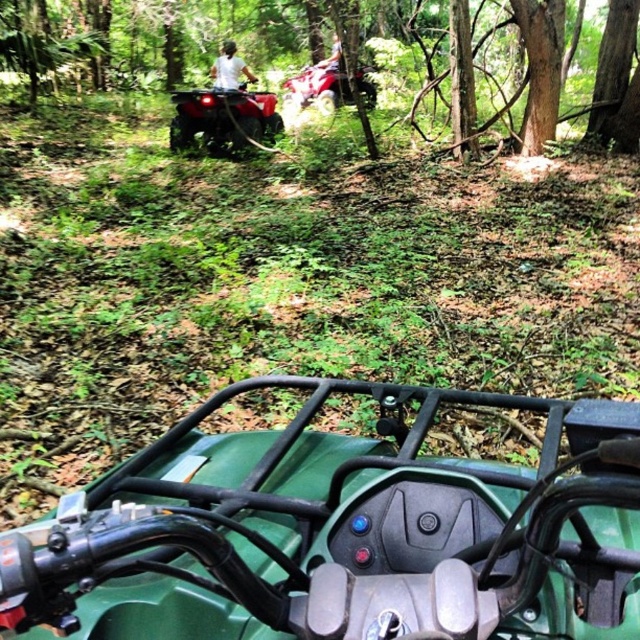
You are riding the green matte quad bike at center and looking forward. Is the white matte shirt at upper center located above or below your current position?

The white matte shirt at upper center is located above the green matte quad bike at center, so it is above your current position.

You are riding the green ATV and notice two points marked on your dashboard. The first point is at coordinates point (161, 627) and the second is at point (256, 80). Which point is closer to you as you look at the dashboard?

Point (161, 627) is closer to the viewer than point (256, 80).